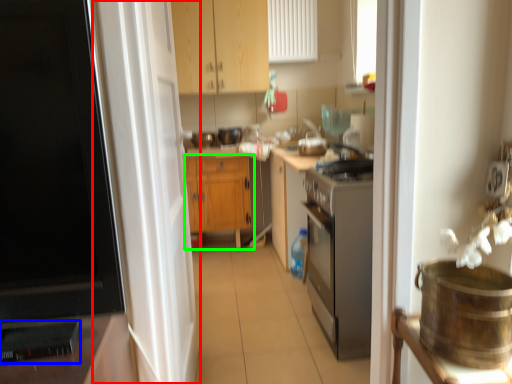
Question: Considering the real-world distances, which object is closest to screen door (highlighted by a red box)? appliance (highlighted by a blue box) or cabinetry (highlighted by a green box).

Choices:
 (A) appliance
 (B) cabinetry

Answer: (A)